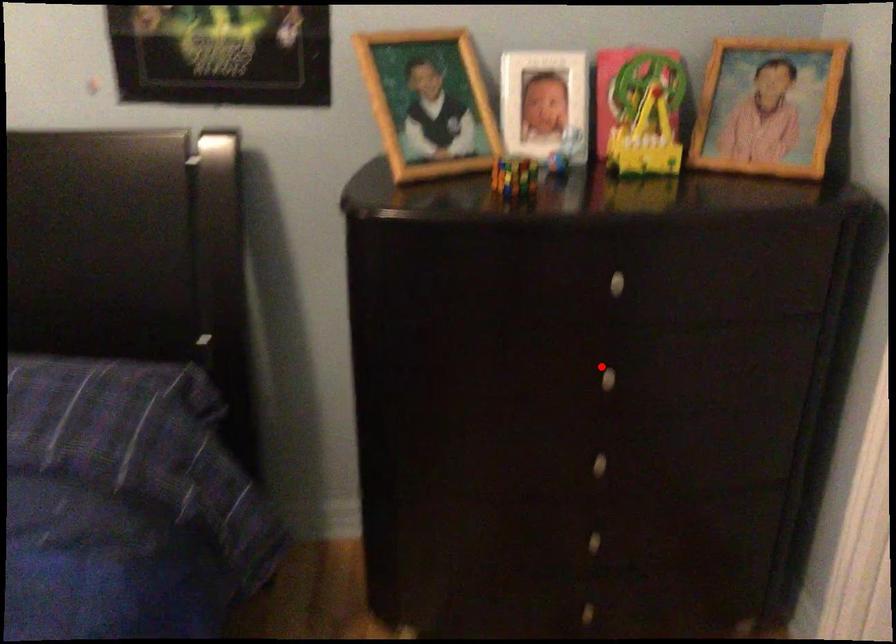
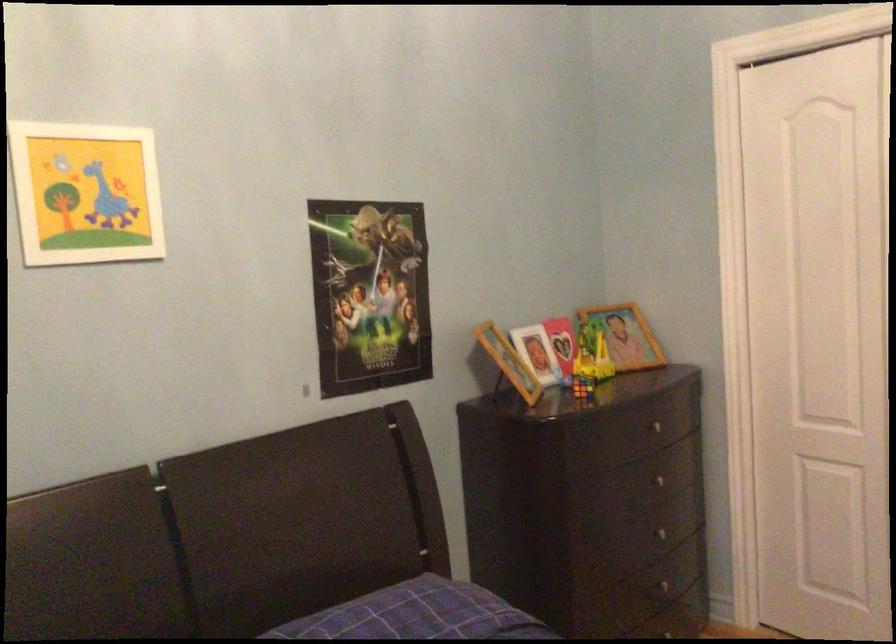
Question: A red point is marked in image1. In image2, is the corresponding 3D point closer to the camera or farther? Reply with the corresponding letter.

Choices:
 (A) The corresponding 3D point is closer.
 (B) The corresponding 3D point is farther.

Answer: (B)